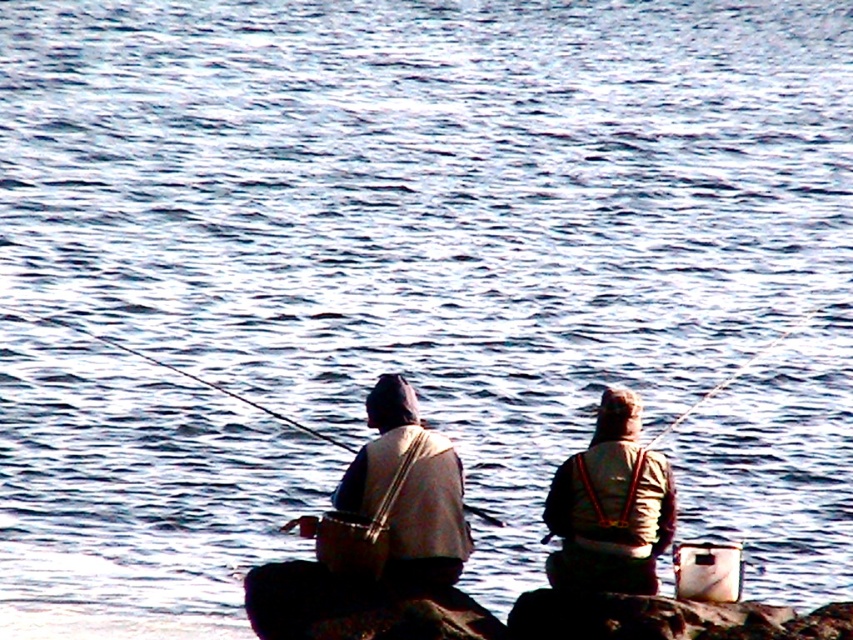
How much distance is there between tan fabric jacket at center and camouflage fabric jacket at center?

tan fabric jacket at center and camouflage fabric jacket at center are 1.48 inches apart.

Which is below, tan fabric jacket at center or camouflage fabric jacket at center?

Positioned lower is tan fabric jacket at center.

This screenshot has height=640, width=853. What do you see at coordinates (610, 506) in the screenshot?
I see `tan fabric jacket at center` at bounding box center [610, 506].

At what (x,y) coordinates should I click in order to perform the action: click on tan fabric jacket at center. Please return your answer as a coordinate pair (x, y). Looking at the image, I should click on (610, 506).

Can you confirm if tan fabric jacket at center is bigger than smooth plastic fishing pole at center?

Actually, tan fabric jacket at center might be smaller than smooth plastic fishing pole at center.

Describe the element at coordinates (610, 506) in the screenshot. I see `tan fabric jacket at center` at that location.

Where is `tan fabric jacket at center`? This screenshot has width=853, height=640. tan fabric jacket at center is located at coordinates (610, 506).

Who is shorter, camouflage fabric jacket at center or smooth plastic fishing pole at center?

Standing shorter between the two is camouflage fabric jacket at center.

The height and width of the screenshot is (640, 853). I want to click on camouflage fabric jacket at center, so click(x=610, y=506).

Find the location of a particular element. This screenshot has height=640, width=853. camouflage fabric jacket at center is located at coordinates (610, 506).